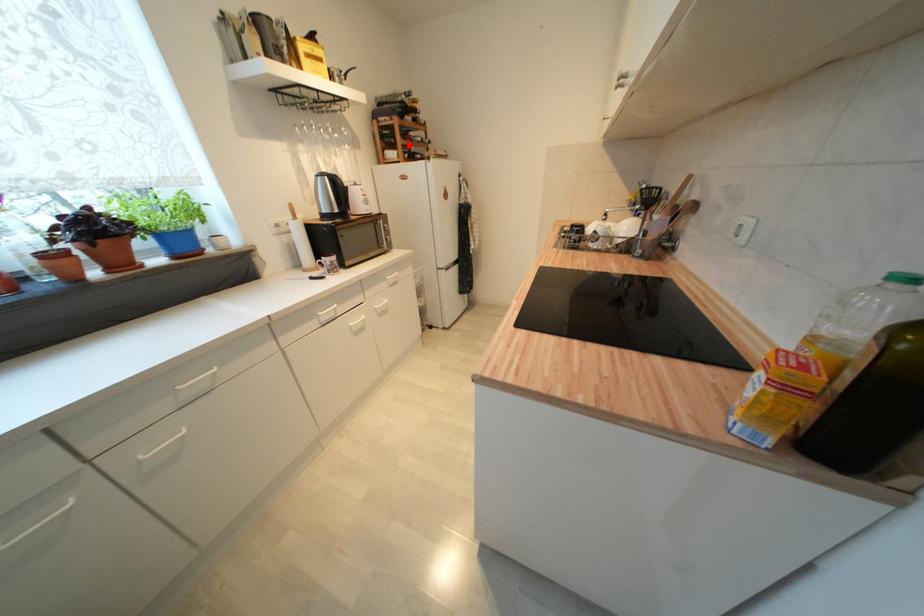
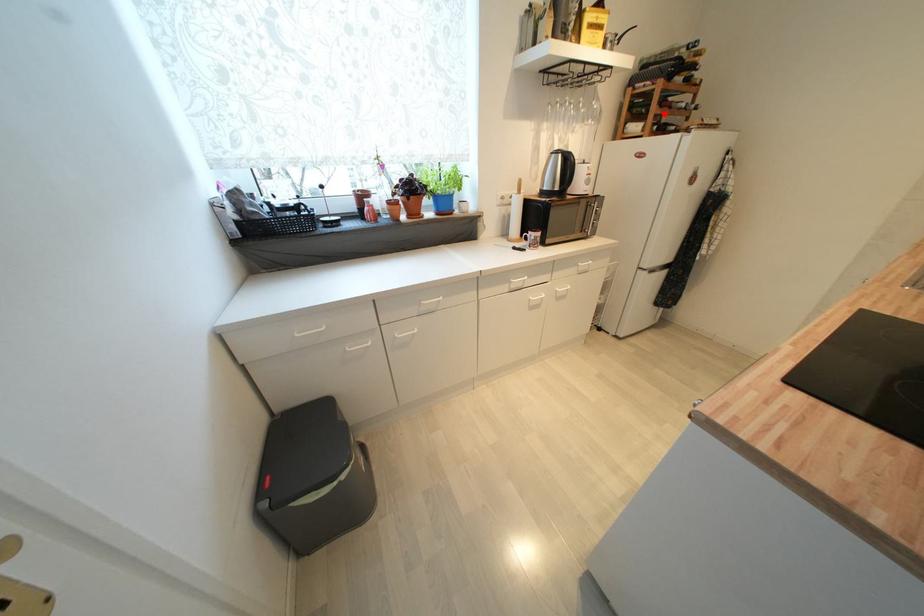
I am providing you with two images of the same scene from different viewpoints. A red point is marked on the first image and another point is marked on the second image. Does the point marked in image1 correspond to the same location as the one in image2?

Yes